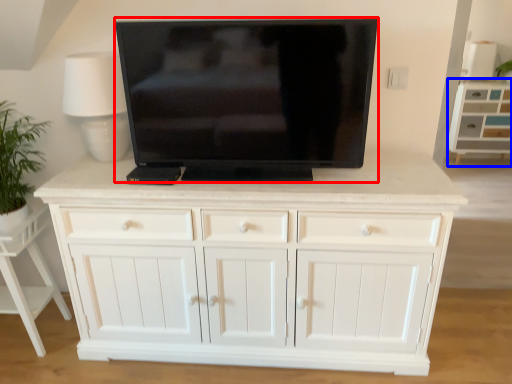
Question: Which of the following is the closest to the observer, television (highlighted by a red box) or cabinetry (highlighted by a blue box)?

Choices:
 (A) television
 (B) cabinetry

Answer: (A)